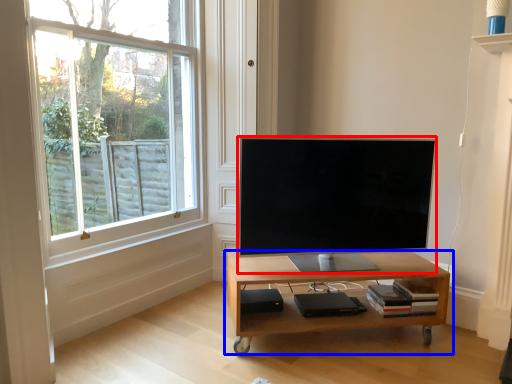
Question: Which object is further to the camera taking this photo, television (highlighted by a red box) or table (highlighted by a blue box)?

Choices:
 (A) television
 (B) table

Answer: (B)